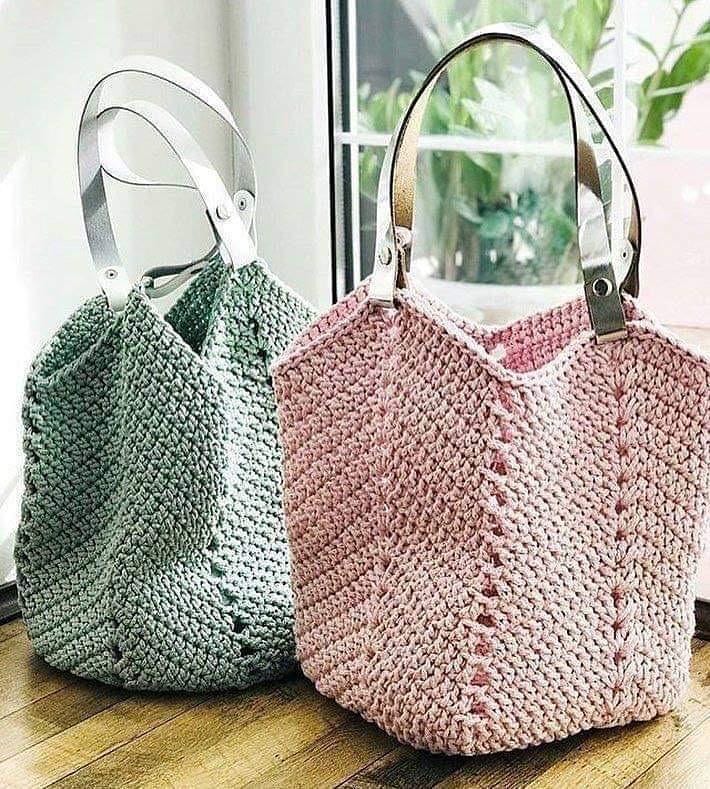
Where is `window`? The height and width of the screenshot is (789, 710). window is located at coordinates (393, 47).